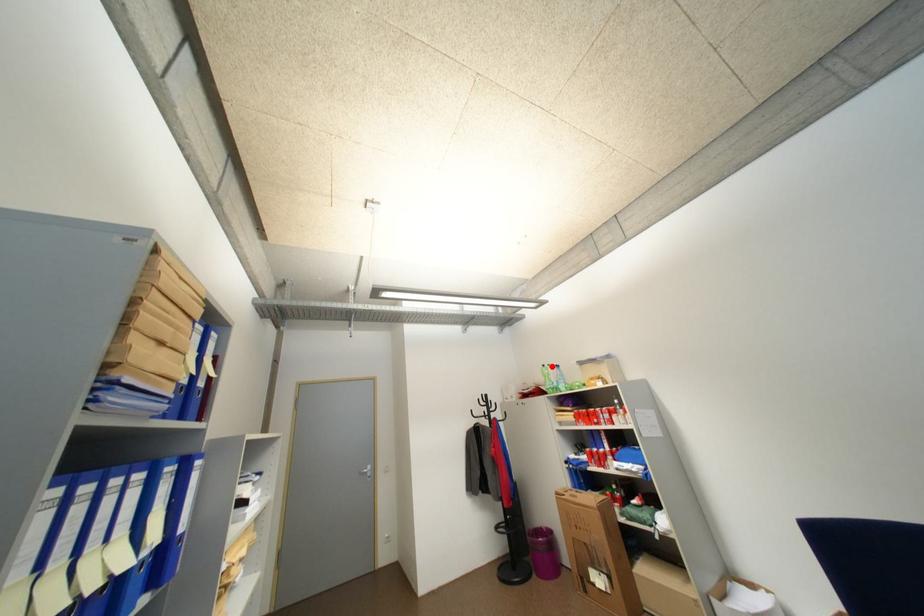
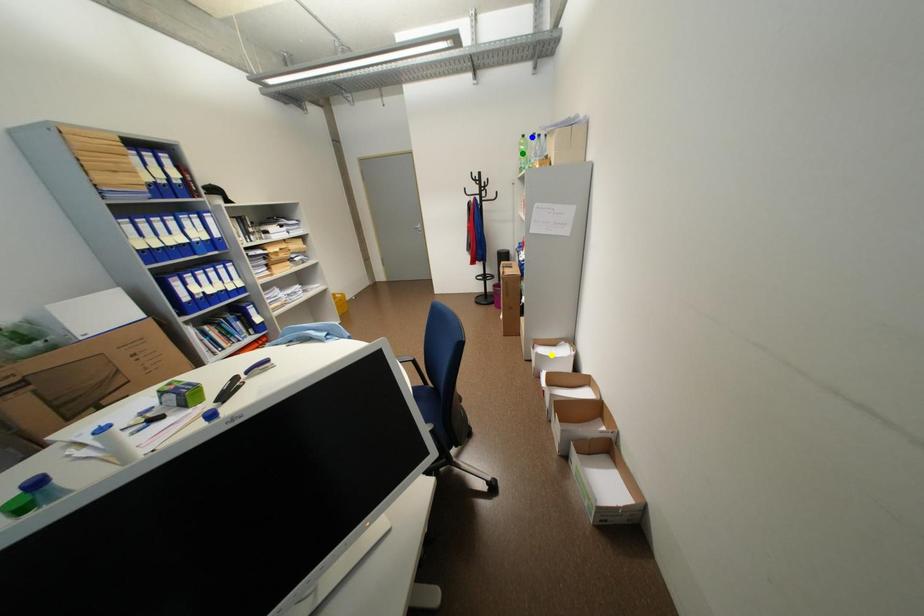
Question: I am providing you with two images of the same scene from different viewpoints. A red point is marked on the first image. You are given multiple points on the second image. Can you choose the point in image 2 that corresponds to the point in image 1?

Choices:
 (A) yellow point
 (B) blue point
 (C) green point

Answer: (B)